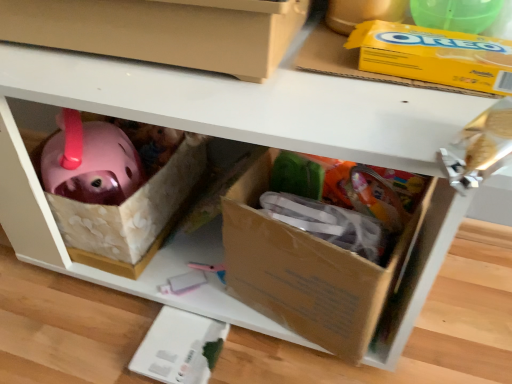
Question: Is matte cardboard box at center, which ranks as the 2th box in bottom-to-top order, inside or outside of yellow cardboard box at upper right?

Choices:
 (A) inside
 (B) outside

Answer: (B)

Question: Is point (105, 51) positioned closer to the camera than point (483, 84)?

Choices:
 (A) farther
 (B) closer

Answer: (A)

Question: Estimate the real-world distances between objects in this image. Which object is farther from the matte cardboard box at center, which ranks as the 2th box in bottom-to-top order?

Choices:
 (A) yellow cardboard box at upper right
 (B) cardboard box at lower right, the first box from the bottom

Answer: (B)

Question: Which object is the closest to the cardboard box at lower right, the first box from the bottom?

Choices:
 (A) matte cardboard box at center, arranged as the first box when viewed from the top
 (B) yellow cardboard box at upper right

Answer: (B)